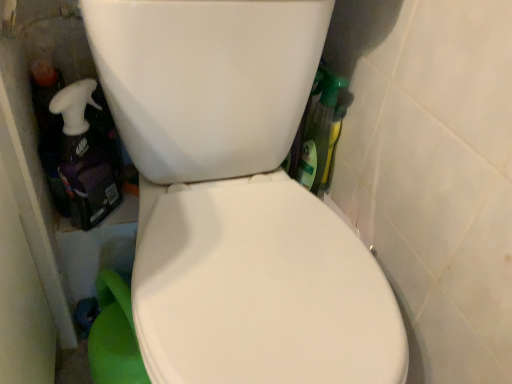
Question: Is translucent purple spray bottle at left wider than white glossy toilet at center?

Choices:
 (A) no
 (B) yes

Answer: (A)

Question: Does translucent purple spray bottle at left have a smaller size compared to white glossy toilet at center?

Choices:
 (A) no
 (B) yes

Answer: (B)

Question: Is translucent purple spray bottle at left positioned far away from white glossy toilet at center?

Choices:
 (A) yes
 (B) no

Answer: (B)

Question: Is the depth of translucent purple spray bottle at left greater than that of white glossy toilet at center?

Choices:
 (A) yes
 (B) no

Answer: (A)

Question: From the image's perspective, does translucent purple spray bottle at left appear lower than white glossy toilet at center?

Choices:
 (A) no
 (B) yes

Answer: (A)

Question: Is translucent purple spray bottle at left at the left side of white glossy toilet at center?

Choices:
 (A) no
 (B) yes

Answer: (B)

Question: Is white glossy toilet at center to the right of translucent purple spray bottle at left from the viewer's perspective?

Choices:
 (A) no
 (B) yes

Answer: (B)

Question: Is the surface of white glossy toilet at center in direct contact with translucent purple spray bottle at left?

Choices:
 (A) yes
 (B) no

Answer: (B)

Question: Is white glossy toilet at center to the left of translucent purple spray bottle at left from the viewer's perspective?

Choices:
 (A) yes
 (B) no

Answer: (B)

Question: Considering the relative positions of white glossy toilet at center and translucent purple spray bottle at left in the image provided, is white glossy toilet at center in front of translucent purple spray bottle at left?

Choices:
 (A) yes
 (B) no

Answer: (A)

Question: Is white glossy toilet at center far from translucent purple spray bottle at left?

Choices:
 (A) yes
 (B) no

Answer: (B)

Question: Would you say white glossy toilet at center is outside translucent purple spray bottle at left?

Choices:
 (A) no
 (B) yes

Answer: (B)

Question: Relative to white glossy toilet at center, is translucent purple spray bottle at left in front or behind?

Choices:
 (A) front
 (B) behind

Answer: (B)